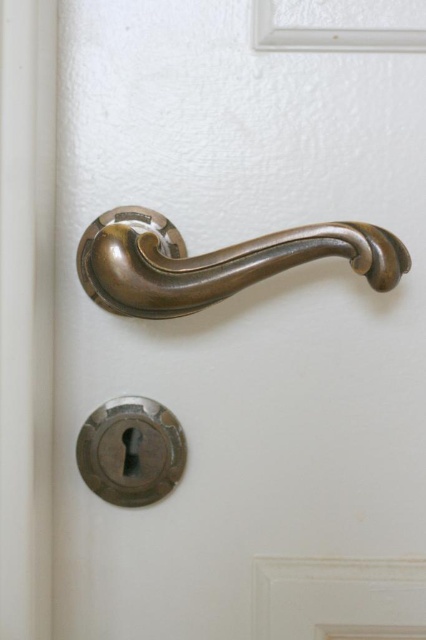
From the picture: Is bronze polished door handle at center behind matte silver keyhole at lower center?

No, it is in front of matte silver keyhole at lower center.

Where is `bronze polished door handle at center`? The image size is (426, 640). bronze polished door handle at center is located at coordinates (215, 260).

The width and height of the screenshot is (426, 640). Identify the location of bronze polished door handle at center. (215, 260).